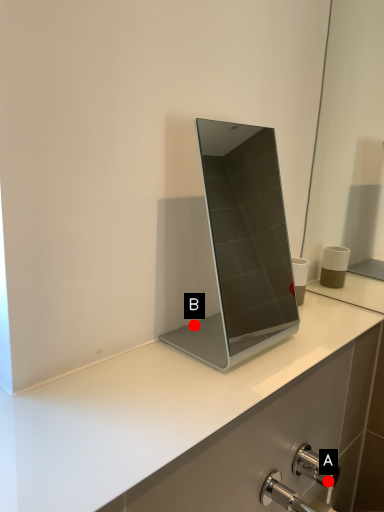
Question: Two points are circled on the image, labeled by A and B beside each circle. Which of the following is the farthest from the observer?

Choices:
 (A) A is further
 (B) B is further

Answer: (A)